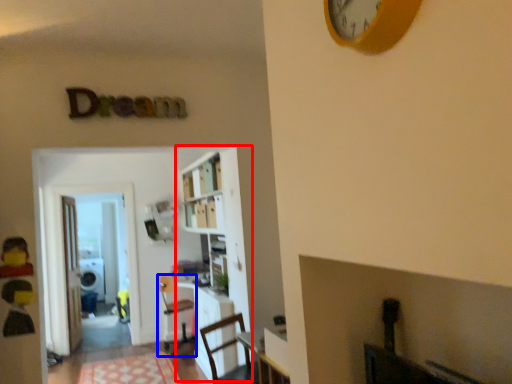
Question: Which point is further to the camera, bookcase (highlighted by a red box) or chair (highlighted by a blue box)?

Choices:
 (A) bookcase
 (B) chair

Answer: (B)